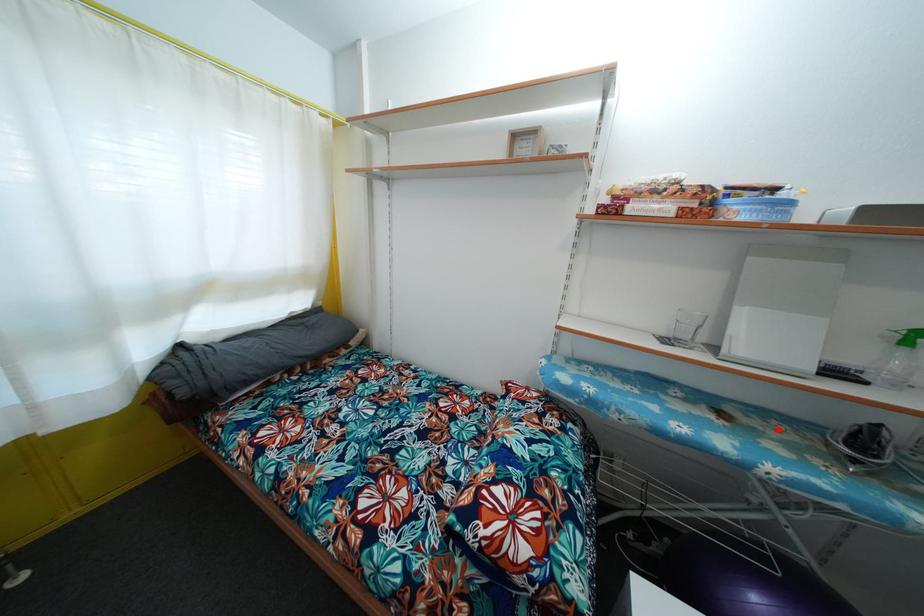
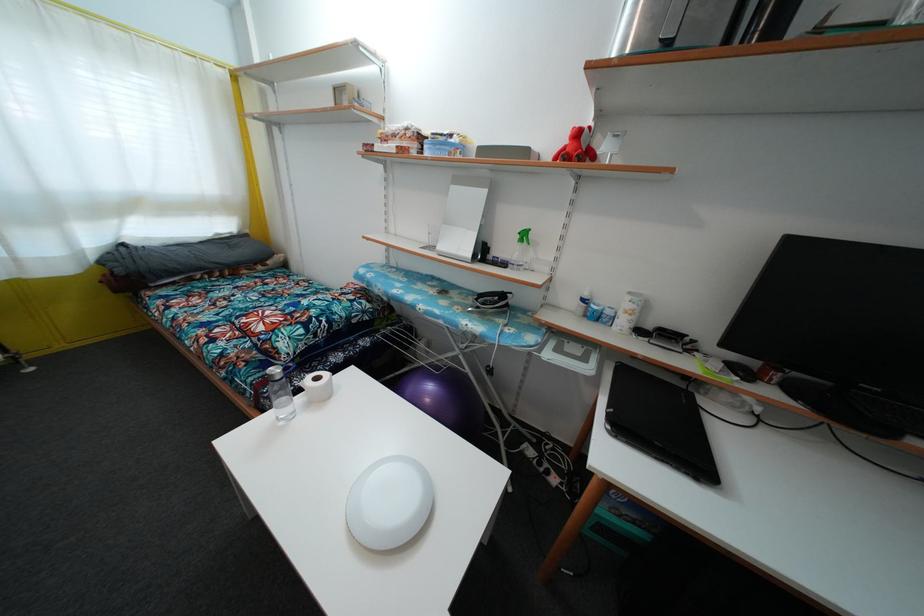
Where in the second image is the point corresponding to the highlighted location from the first image?

(475, 304)